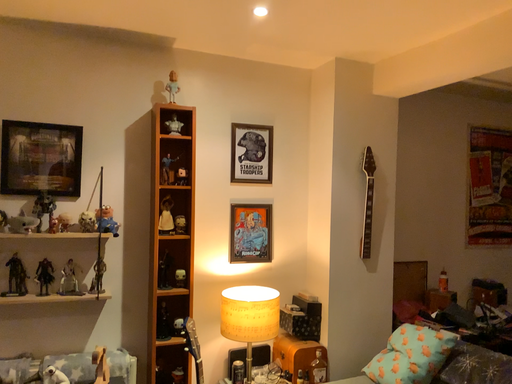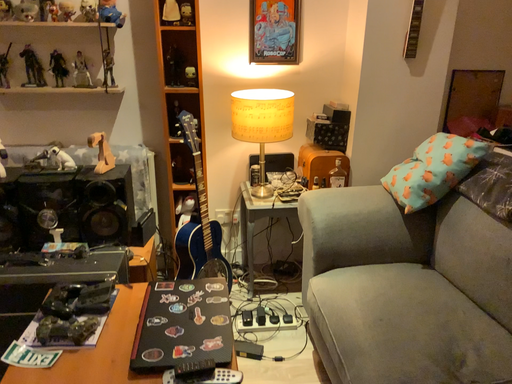
Question: Which way did the camera rotate in the video?

Choices:
 (A) rotated upward
 (B) rotated downward

Answer: (B)